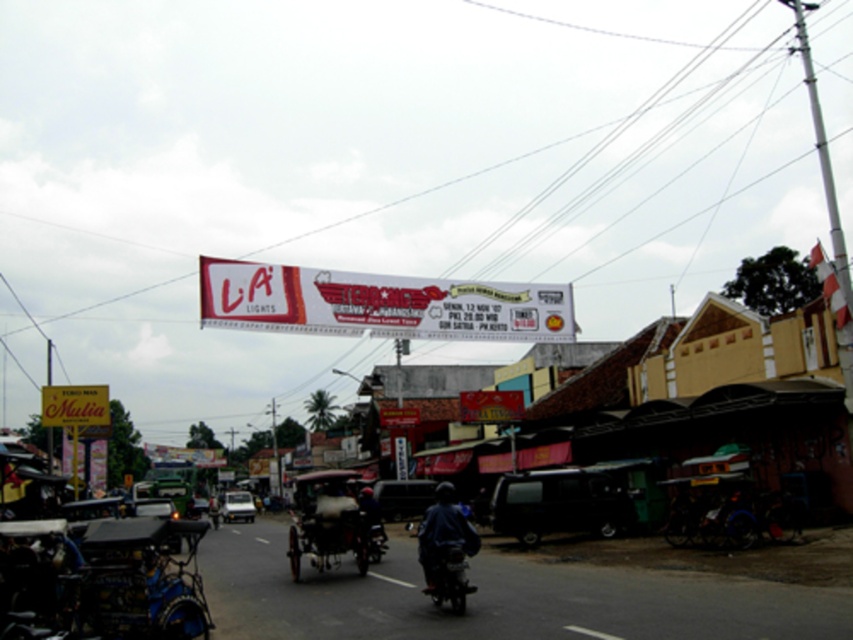
Question: Estimate the real-world distances between objects in this image. Which object is closer to the black matte van at center?

Choices:
 (A) white glossy banner at center
 (B) dark blue matte motorcycle at center
 (C) dark blue fabric jacket at center
 (D) white matte car at center

Answer: (C)

Question: Which point is farther to the camera?

Choices:
 (A) white matte car at center
 (B) black matte van at center

Answer: (A)

Question: Which point is farther to the camera?

Choices:
 (A) white matte car at center
 (B) black matte van at center
 (C) white glossy banner at center
 (D) dark blue matte motorcycle at center

Answer: (A)

Question: Does dark blue matte motorcycle at center appear under metallic silver car at center?

Choices:
 (A) no
 (B) yes

Answer: (A)

Question: Does black matte van at center have a greater width compared to dark blue fabric jacket at center?

Choices:
 (A) yes
 (B) no

Answer: (A)

Question: Does dark blue matte motorcycle at center come in front of metallic silver car at center?

Choices:
 (A) yes
 (B) no

Answer: (A)